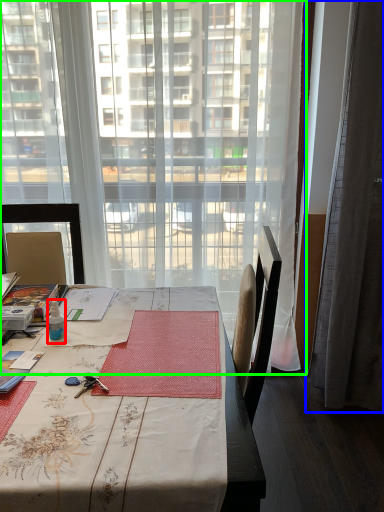
Question: Which object is positioned farthest from bottle (highlighted by a red box)? Select from curtain (highlighted by a blue box) and window (highlighted by a green box).

Choices:
 (A) curtain
 (B) window

Answer: (A)